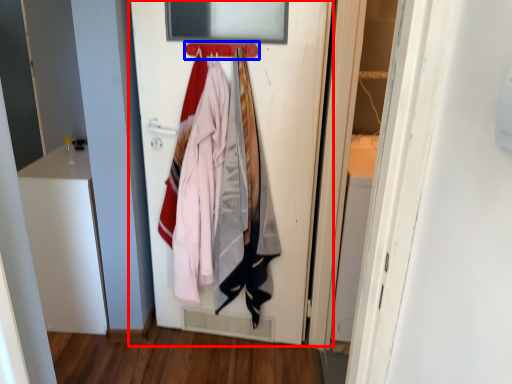
Question: Which point is further to the camera, door (highlighted by a red box) or hanger (highlighted by a blue box)?

Choices:
 (A) door
 (B) hanger

Answer: (B)